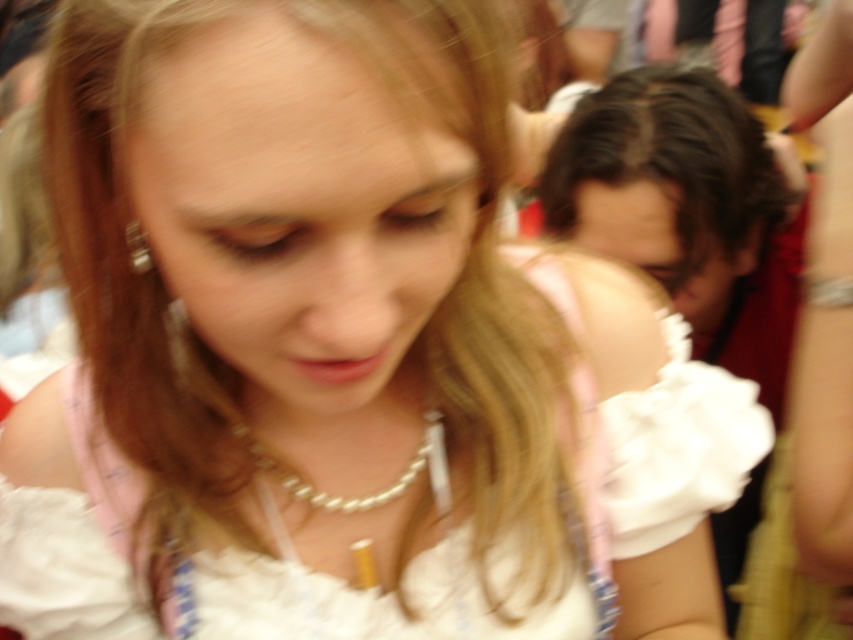
Question: Which point is farther to the camera?

Choices:
 (A) (280, 483)
 (B) (714, 150)

Answer: (B)

Question: Is the position of dark brown hair at upper right less distant than that of pearl necklace at center?

Choices:
 (A) no
 (B) yes

Answer: (A)

Question: Observing the image, what is the correct spatial positioning of dark brown hair at upper right in reference to pearl necklace at center?

Choices:
 (A) below
 (B) above

Answer: (B)

Question: Which of the following is the closest to the observer?

Choices:
 (A) (714, 141)
 (B) (256, 456)

Answer: (B)

Question: Is dark brown hair at upper right to the right of pearl necklace at center from the viewer's perspective?

Choices:
 (A) no
 (B) yes

Answer: (B)